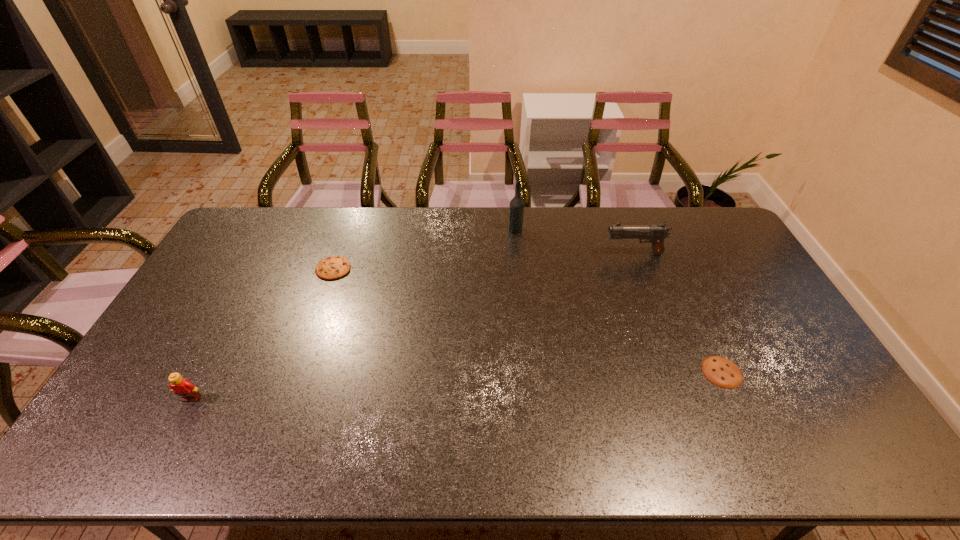
Locate an element on the screen. The image size is (960, 540). the farthest object is located at coordinates [516, 208].

Locate an element on the screen. Image resolution: width=960 pixels, height=540 pixels. the tallest object is located at coordinates point(516,208).

The height and width of the screenshot is (540, 960). I want to click on the second tallest object, so (x=655, y=233).

I want to click on gun, so click(x=655, y=233).

Image resolution: width=960 pixels, height=540 pixels. Find the location of `the third tallest object`. the third tallest object is located at coordinates (182, 387).

Locate an element on the screen. The width and height of the screenshot is (960, 540). Lego is located at coordinates (182, 387).

Find the location of a particular element. This screenshot has width=960, height=540. the left cookie is located at coordinates (334, 267).

At what (x,y) coordinates should I click in order to perform the action: click on the farther cookie. Please return your answer as a coordinate pair (x, y). The image size is (960, 540). Looking at the image, I should click on (334, 267).

Identify the location of the second nearest object. This screenshot has height=540, width=960. (722, 372).

In order to click on the right cookie in this screenshot , I will do `click(722, 372)`.